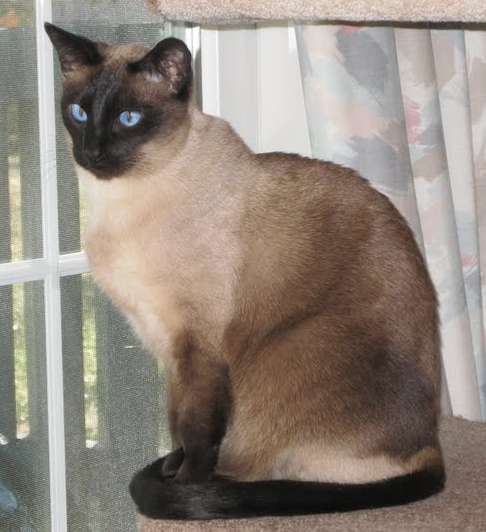
At what (x,y) coordinates should I click in order to perform the action: click on screen. Please return your answer as a coordinate pair (x, y). The width and height of the screenshot is (486, 532). Looking at the image, I should click on (99, 384).